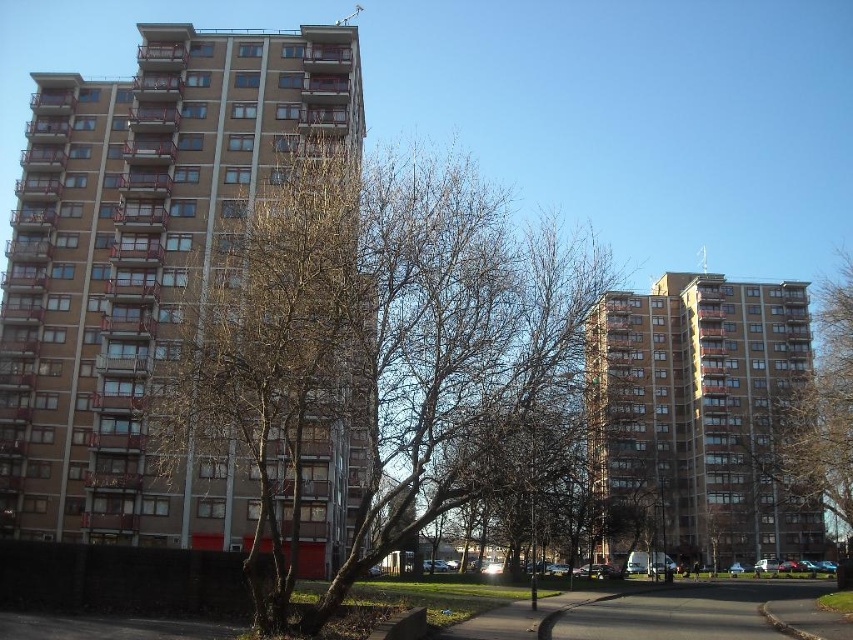
You are standing in the residential area and want to take a photo of both the brown leafless tree at left and the bare branches at right in the same frame. Based on their positions, which object should you position closer to the left side of your camera viewfinder?

The brown leafless tree at left should be positioned closer to the left side of your camera viewfinder since it is located to the left of the bare branches at right.

You are a city planner analyzing the image. You need to determine which object occupies more space in the scene between the brown concrete building at left and the bare branches at right. Based on their sizes, which one is larger?

The brown concrete building at left has a smaller size compared to bare branches at right, so the bare branches at right occupy more space in the scene.